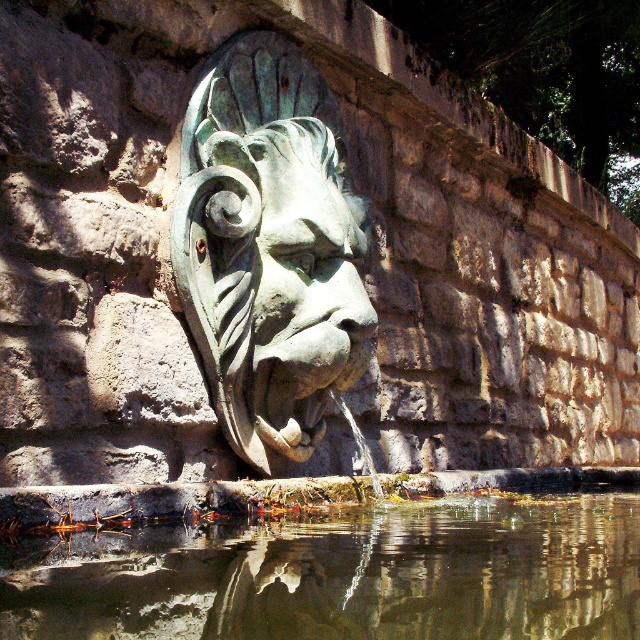
Who is shorter, green patina stone lion head at center or green patina stone face at center?

green patina stone face at center is shorter.

Who is taller, green patina stone lion head at center or green patina stone face at center?

green patina stone lion head at center is taller.

This screenshot has height=640, width=640. Find the location of `green patina stone lion head at center`. green patina stone lion head at center is located at coordinates (269, 248).

The image size is (640, 640). I want to click on green patina stone lion head at center, so click(269, 248).

Between clear water at lower center and green patina stone lion head at center, which one has more height?

green patina stone lion head at center

Is clear water at lower center to the left of green patina stone lion head at center from the viewer's perspective?

In fact, clear water at lower center is to the right of green patina stone lion head at center.

Between point (205, 637) and point (282, 292), which one is positioned in front?

Point (205, 637) is more forward.

Locate an element on the screen. The image size is (640, 640). clear water at lower center is located at coordinates (342, 573).

This screenshot has height=640, width=640. In order to click on clear water at lower center in this screenshot , I will do `click(342, 573)`.

Which is more to the left, clear water at lower center or green patina stone face at center?

green patina stone face at center

Between point (534, 577) and point (260, 161), which one is positioned in front?

Point (534, 577) is more forward.

I want to click on clear water at lower center, so click(x=342, y=573).